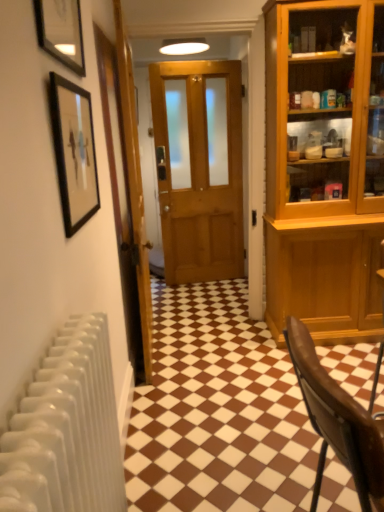
Image resolution: width=384 pixels, height=512 pixels. What do you see at coordinates (61, 31) in the screenshot?
I see `matte black picture frame at upper left, placed as the 2th picture frame when sorted from bottom to top` at bounding box center [61, 31].

What is the approximate height of brown leather chair at lower right?

brown leather chair at lower right is 69.34 centimeters in height.

The image size is (384, 512). Find the location of `brown leather chair at lower right`. brown leather chair at lower right is located at coordinates (338, 422).

The height and width of the screenshot is (512, 384). Describe the element at coordinates (217, 411) in the screenshot. I see `brown glossy tile at center` at that location.

Locate an element on the screen. This screenshot has height=512, width=384. brown glossy tile at center is located at coordinates 217,411.

What do you see at coordinates (74, 152) in the screenshot?
I see `black framed picture at upper left, positioned as the 1th picture frame in bottom-to-top order` at bounding box center [74, 152].

In order to face black framed picture at upper left, positioned as the 1th picture frame in bottom-to-top order, should I rotate leftwards or rightwards?

To align with it, rotate left about 15.056°.

This screenshot has width=384, height=512. What do you see at coordinates (126, 199) in the screenshot?
I see `wooden door at center, which is counted as the second door, starting from the right` at bounding box center [126, 199].

At what (x,y) coordinates should I click in order to perform the action: click on matte black picture frame at upper left, which is counted as the 1th picture frame, starting from the top. Please return your answer as a coordinate pair (x, y). Looking at the image, I should click on (61, 31).

Can you confirm if brown leather chair at lower right is thinner than wooden door at center, which is the first door from right to left?

No, brown leather chair at lower right is not thinner than wooden door at center, which is the first door from right to left.

This screenshot has width=384, height=512. I want to click on door that is the 2nd one above the brown leather chair at lower right (from a real-world perspective), so click(199, 168).

In the scene shown: Considering the sizes of brown leather chair at lower right and wooden door at center, which is the first door from right to left, in the image, is brown leather chair at lower right taller or shorter than wooden door at center, which is the first door from right to left,?

brown leather chair at lower right is shorter than wooden door at center, which is the first door from right to left.

Could you tell me if brown leather chair at lower right is turned towards wooden door at center, which is the first door from right to left?

No, brown leather chair at lower right is not oriented towards wooden door at center, which is the first door from right to left.

What's the angular difference between brown leather chair at lower right and wooden door at center, which is counted as the second door, starting from the right,'s facing directions?

3.78 degrees.

Is point (327, 396) closer to camera compared to point (131, 276)?

That is True.

Is brown leather chair at lower right inside the boundaries of wooden door at center, the first door when ordered from left to right, or outside?

brown leather chair at lower right lies outside wooden door at center, the first door when ordered from left to right.

In terms of size, does brown leather chair at lower right appear bigger or smaller than wooden door at center, the first door when ordered from left to right?

brown leather chair at lower right is smaller than wooden door at center, the first door when ordered from left to right.

What's the angular difference between brown glossy tile at center and wooden door at center, the second door positioned from the left,'s facing directions?

There is a 0.345-degree angle between the facing directions of brown glossy tile at center and wooden door at center, the second door positioned from the left.

In the image, there is a wooden door at center, which is the first door from right to left. Identify the location of tile below it (from the image's perspective). (217, 411).

Considering the relative sizes of brown glossy tile at center and wooden door at center, which is the first door from right to left, in the image provided, is brown glossy tile at center taller than wooden door at center, which is the first door from right to left,?

Incorrect, the height of brown glossy tile at center is not larger of that of wooden door at center, which is the first door from right to left.

Does brown glossy tile at center contain wooden door at center, which is the first door from right to left?

No, wooden door at center, which is the first door from right to left, is not a part of brown glossy tile at center.

Measure the distance from wooden door at center, which is counted as the second door, starting from the right, to matte black picture frame at upper left, which is counted as the 1th picture frame, starting from the top.

wooden door at center, which is counted as the second door, starting from the right, and matte black picture frame at upper left, which is counted as the 1th picture frame, starting from the top, are 31.81 inches apart from each other.

From the image's perspective, between wooden door at center, which is counted as the second door, starting from the right, and matte black picture frame at upper left, which is counted as the 1th picture frame, starting from the top, which one is located above?

matte black picture frame at upper left, which is counted as the 1th picture frame, starting from the top, is shown above in the image.

How different are the orientations of wooden door at center, which is counted as the second door, starting from the right, and matte black picture frame at upper left, which is counted as the 1th picture frame, starting from the top, in degrees?

wooden door at center, which is counted as the second door, starting from the right, and matte black picture frame at upper left, which is counted as the 1th picture frame, starting from the top, are facing 2.54 degrees away from each other.

Could you tell me if wooden door at center, which is counted as the second door, starting from the right, is turned towards matte black picture frame at upper left, which is counted as the 1th picture frame, starting from the top?

No, wooden door at center, which is counted as the second door, starting from the right, does not turn towards matte black picture frame at upper left, which is counted as the 1th picture frame, starting from the top.

Considering the sizes of brown glossy tile at center and black framed picture at upper left, positioned as the 1th picture frame in bottom-to-top order, in the image, is brown glossy tile at center taller or shorter than black framed picture at upper left, positioned as the 1th picture frame in bottom-to-top order,?

Considering their sizes, brown glossy tile at center has less height than black framed picture at upper left, positioned as the 1th picture frame in bottom-to-top order.

Considering the positions of objects brown glossy tile at center and black framed picture at upper left, positioned as the 1th picture frame in bottom-to-top order, in the image provided, who is more to the right, brown glossy tile at center or black framed picture at upper left, positioned as the 1th picture frame in bottom-to-top order,?

brown glossy tile at center is more to the right.

From a real-world perspective, is brown glossy tile at center on top of black framed picture at upper left, marked as the 2th picture frame in a top-to-bottom arrangement?

No, from a real-world perspective, brown glossy tile at center is not on top of black framed picture at upper left, marked as the 2th picture frame in a top-to-bottom arrangement.

Which of these two, black framed picture at upper left, positioned as the 1th picture frame in bottom-to-top order, or matte black picture frame at upper left, which is counted as the 1th picture frame, starting from the top, stands shorter?

matte black picture frame at upper left, which is counted as the 1th picture frame, starting from the top.

From a real-world perspective, is black framed picture at upper left, marked as the 2th picture frame in a top-to-bottom arrangement, positioned over matte black picture frame at upper left, placed as the 2th picture frame when sorted from bottom to top, based on gravity?

No, from a real-world perspective, black framed picture at upper left, marked as the 2th picture frame in a top-to-bottom arrangement, is not over matte black picture frame at upper left, placed as the 2th picture frame when sorted from bottom to top

Is black framed picture at upper left, marked as the 2th picture frame in a top-to-bottom arrangement, directly adjacent to matte black picture frame at upper left, placed as the 2th picture frame when sorted from bottom to top?

black framed picture at upper left, marked as the 2th picture frame in a top-to-bottom arrangement, is not next to matte black picture frame at upper left, placed as the 2th picture frame when sorted from bottom to top, and they're not touching.

Is wooden door at center, which is counted as the second door, starting from the right, positioned in front of brown glossy tile at center?

No, wooden door at center, which is counted as the second door, starting from the right, is further to the viewer.

Does wooden door at center, the first door when ordered from left to right, have a lesser height compared to brown glossy tile at center?

No, wooden door at center, the first door when ordered from left to right, is not shorter than brown glossy tile at center.

This screenshot has height=512, width=384. Identify the location of tile on the right of wooden door at center, the first door when ordered from left to right. (217, 411).

Is brown glossy tile at center at the back of wooden door at center, the first door when ordered from left to right?

No.

Identify the location of chair that appears below the wooden door at center, which is the first door from right to left (from a real-world perspective). (338, 422).

This screenshot has height=512, width=384. What are the coordinates of `door that is the 1st one when counting backward from the brown leather chair at lower right` in the screenshot? It's located at (126, 199).

Looking at the image, which one is located further to matte black picture frame at upper left, which is counted as the 1th picture frame, starting from the top, wooden door at center, which is counted as the second door, starting from the right, or wooden door at center, the second door positioned from the left?

Based on the image, wooden door at center, the second door positioned from the left, appears to be further to matte black picture frame at upper left, which is counted as the 1th picture frame, starting from the top.

Based on their spatial positions, is wooden door at center, the first door when ordered from left to right, or matte black picture frame at upper left, placed as the 2th picture frame when sorted from bottom to top, closer to black framed picture at upper left, positioned as the 1th picture frame in bottom-to-top order?

The object closer to black framed picture at upper left, positioned as the 1th picture frame in bottom-to-top order, is matte black picture frame at upper left, placed as the 2th picture frame when sorted from bottom to top.

Which object lies nearer to the anchor point matte black picture frame at upper left, placed as the 2th picture frame when sorted from bottom to top, black framed picture at upper left, marked as the 2th picture frame in a top-to-bottom arrangement, or wooden door at center, which is counted as the second door, starting from the right?

black framed picture at upper left, marked as the 2th picture frame in a top-to-bottom arrangement, is positioned closer to the anchor matte black picture frame at upper left, placed as the 2th picture frame when sorted from bottom to top.

Based on their spatial positions, is brown glossy tile at center or wooden door at center, the second door positioned from the left, closer to matte black picture frame at upper left, which is counted as the 1th picture frame, starting from the top?

brown glossy tile at center is positioned closer to the anchor matte black picture frame at upper left, which is counted as the 1th picture frame, starting from the top.

Which object lies further to the anchor point brown glossy tile at center, black framed picture at upper left, marked as the 2th picture frame in a top-to-bottom arrangement, or wooden door at center, which is counted as the second door, starting from the right?

The object further to brown glossy tile at center is black framed picture at upper left, marked as the 2th picture frame in a top-to-bottom arrangement.

Estimate the real-world distances between objects in this image. Which object is closer to brown glossy tile at center, matte black picture frame at upper left, placed as the 2th picture frame when sorted from bottom to top, or wooden door at center, the first door when ordered from left to right?

wooden door at center, the first door when ordered from left to right, lies closer to brown glossy tile at center than the other object.

Estimate the real-world distances between objects in this image. Which object is closer to brown leather chair at lower right, black framed picture at upper left, positioned as the 1th picture frame in bottom-to-top order, or wooden door at center, the first door when ordered from left to right?

Among the two, black framed picture at upper left, positioned as the 1th picture frame in bottom-to-top order, is located nearer to brown leather chair at lower right.

Based on their spatial positions, is brown glossy tile at center or wooden door at center, the second door positioned from the left, further from wooden door at center, the first door when ordered from left to right?

wooden door at center, the second door positioned from the left.

In order to click on tile located between black framed picture at upper left, marked as the 2th picture frame in a top-to-bottom arrangement, and wooden door at center, which is the first door from right to left, in the depth direction in this screenshot , I will do `click(217, 411)`.

This screenshot has width=384, height=512. What are the coordinates of `door positioned between black framed picture at upper left, positioned as the 1th picture frame in bottom-to-top order, and wooden door at center, the second door positioned from the left, from near to far` in the screenshot? It's located at (126, 199).

Where is `tile positioned between matte black picture frame at upper left, which is counted as the 1th picture frame, starting from the top, and wooden door at center, which is the first door from right to left, from near to far`? This screenshot has height=512, width=384. tile positioned between matte black picture frame at upper left, which is counted as the 1th picture frame, starting from the top, and wooden door at center, which is the first door from right to left, from near to far is located at coordinates (217, 411).

Find the location of `tile positioned between brown leather chair at lower right and wooden door at center, the first door when ordered from left to right, from near to far`. tile positioned between brown leather chair at lower right and wooden door at center, the first door when ordered from left to right, from near to far is located at coordinates (217, 411).